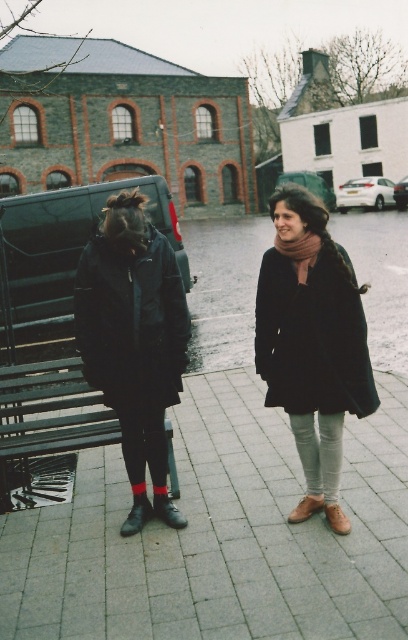
Question: From the image, what is the correct spatial relationship of wooden bench at lower left in relation to black leather boot at lower left?

Choices:
 (A) right
 (B) left

Answer: (B)

Question: Which object is closer to the camera taking this photo?

Choices:
 (A) black rubber boot at lower left
 (B) gray concrete pavement at lower center
 (C) brown suede boot at lower right

Answer: (B)

Question: Is black leather boot at lower left closer to camera compared to brown suede boot at lower right?

Choices:
 (A) yes
 (B) no

Answer: (B)

Question: Is wooden bench at lower left thinner than black leather boot at lower left?

Choices:
 (A) no
 (B) yes

Answer: (A)

Question: Which of the following is the farthest from the observer?

Choices:
 (A) black matte coat at left
 (B) brown leather boot at lower center
 (C) brown suede boot at lower right

Answer: (B)

Question: Which is farther from the gray concrete pavement at lower center?

Choices:
 (A) black rubber boot at lower left
 (B) wooden bench at lower left
 (C) brown leather boot at lower center
 (D) brown suede boot at lower right

Answer: (B)